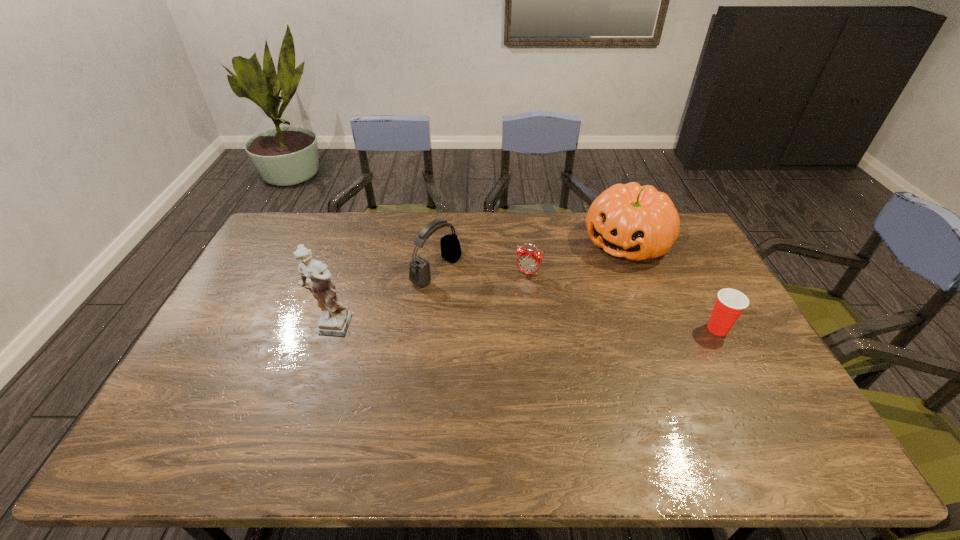
At what (x,y) coordinates should I click in order to perform the action: click on free space located 0.170m on the headband of the headset. Please return your answer as a coordinate pair (x, y). The width and height of the screenshot is (960, 540). Looking at the image, I should click on (497, 305).

You are a GUI agent. You are given a task and a screenshot of the screen. Output one action in this format:
    pyautogui.click(x=<x>, y=<y>)
    Task: Click on the vacant space located 0.370m on the face of the alarm clock
    This screenshot has height=540, width=960.
    Given the screenshot: What is the action you would take?
    (x=483, y=365)

This screenshot has height=540, width=960. What are the coordinates of `vacant space situated on the face of the alarm clock` in the screenshot? It's located at (516, 295).

Locate an element on the screen. This screenshot has width=960, height=540. vacant space located on the face of the alarm clock is located at coordinates (488, 354).

Find the location of `free space located 0.360m on the carved face of the pumpkin`. free space located 0.360m on the carved face of the pumpkin is located at coordinates (550, 326).

Find the location of a particular element. free spot located on the carved face of the pumpkin is located at coordinates (574, 300).

Locate an element on the screen. Image resolution: width=960 pixels, height=540 pixels. vacant space located on the carved face of the pumpkin is located at coordinates (591, 281).

You are a GUI agent. You are given a task and a screenshot of the screen. Output one action in this format:
    pyautogui.click(x=<x>, y=<y>)
    Task: Click on the object at the far edge
    
    Given the screenshot: What is the action you would take?
    pyautogui.click(x=636, y=222)

Image resolution: width=960 pixels, height=540 pixels. Find the location of `Dixie cup positioned at the right edge`. Dixie cup positioned at the right edge is located at coordinates (730, 303).

The width and height of the screenshot is (960, 540). I want to click on pumpkin that is at the right edge, so click(x=636, y=222).